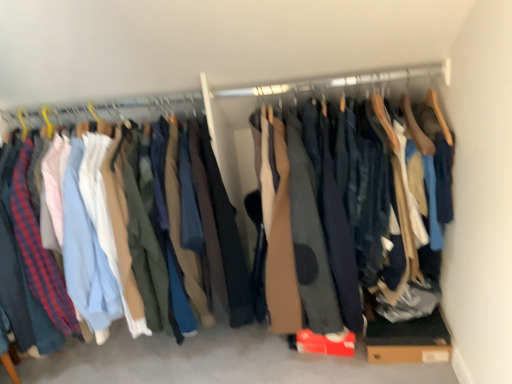
Question: From the image's perspective, relative to dark blue cotton pants at left, is brown cardboard box at lower right above or below?

Choices:
 (A) below
 (B) above

Answer: (A)

Question: Is point (446, 339) closer or farther from the camera than point (325, 230)?

Choices:
 (A) farther
 (B) closer

Answer: (A)

Question: Which object is positioned closest to the wooden hanger at upper center?

Choices:
 (A) dark gray fabric pants at center
 (B) dark blue cotton pants at left
 (C) brown cardboard box at lower right

Answer: (A)

Question: Which is nearer to the dark blue cotton pants at left?

Choices:
 (A) dark gray fabric pants at center
 (B) brown cardboard box at lower right
 (C) wooden hanger at upper center

Answer: (A)